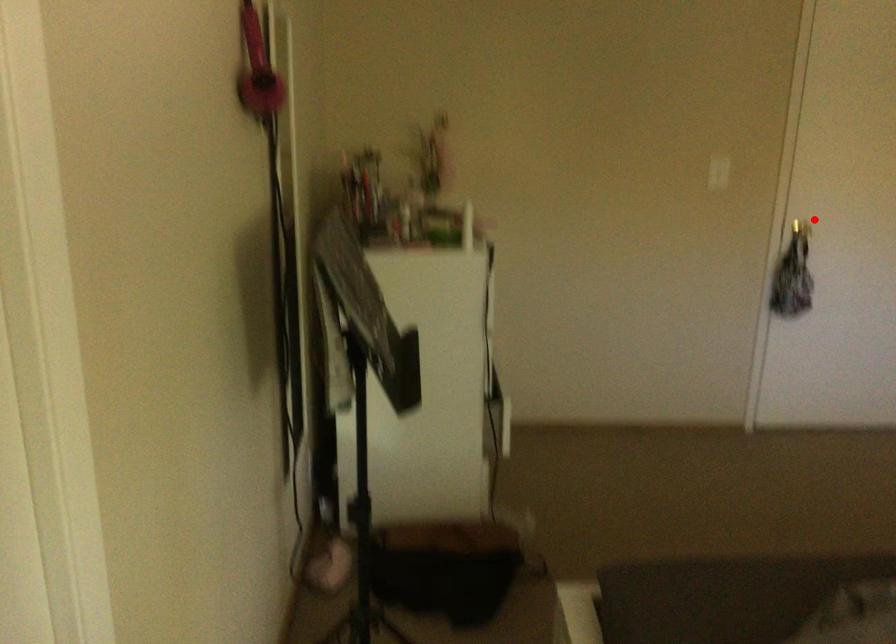
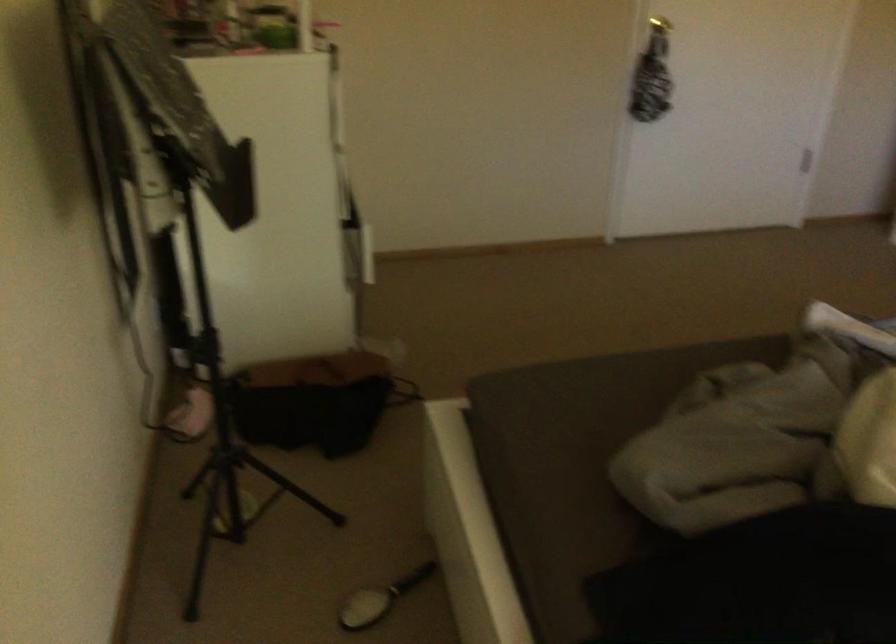
Locate, in the second image, the point that corresponds to the highlighted location in the first image.

(659, 24)